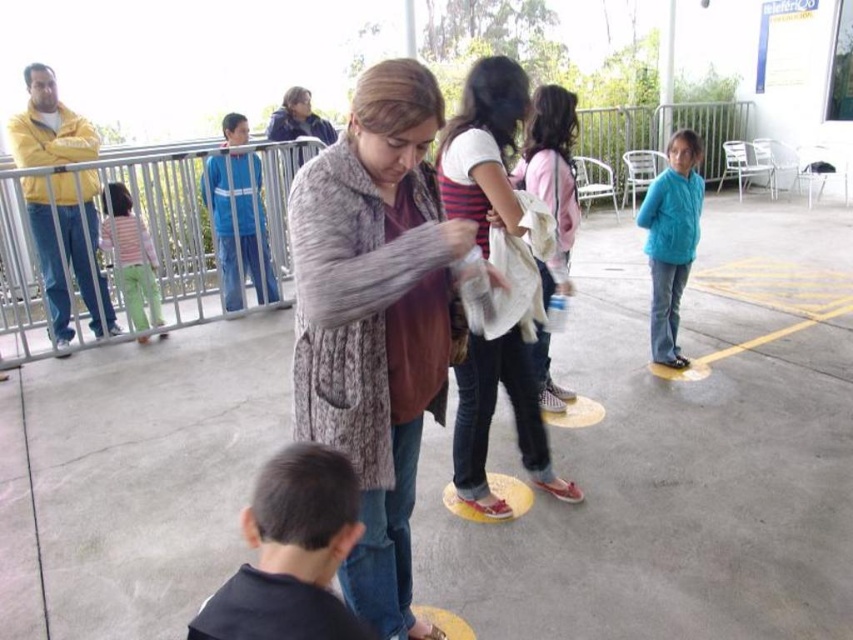
Is point (328, 432) closer to camera compared to point (469, 134)?

Yes.

Is point (433, 96) positioned after point (453, 454)?

No, (433, 96) is in front of (453, 454).

Find the location of a particular element. This screenshot has height=640, width=853. knitted gray scarf at center is located at coordinates (376, 320).

Does white cotton backpack at center have a greater height compared to light pink fabric pants at left?

Yes, white cotton backpack at center is taller than light pink fabric pants at left.

Is point (543, 397) behind point (126, 211)?

No, it is in front of (126, 211).

Between point (564, 188) and point (115, 189), which one is positioned behind?

The point (115, 189) is more distant.

In order to click on white cotton backpack at center in this screenshot , I will do `click(550, 176)`.

Can you confirm if knitted gray scarf at center is taller than white cotton backpack at center?

Yes, knitted gray scarf at center is taller than white cotton backpack at center.

The height and width of the screenshot is (640, 853). In order to click on knitted gray scarf at center in this screenshot , I will do `click(376, 320)`.

At what (x,y) coordinates should I click in order to perform the action: click on knitted gray scarf at center. Please return your answer as a coordinate pair (x, y). The height and width of the screenshot is (640, 853). Looking at the image, I should click on (376, 320).